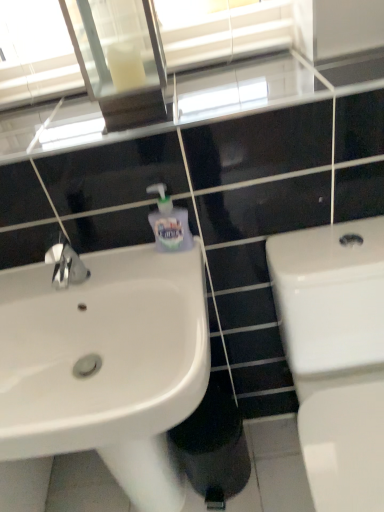
Question: From a real-world perspective, is clear glass mirror at upper center under translucent plastic soap dispenser at upper center?

Choices:
 (A) no
 (B) yes

Answer: (A)

Question: Is clear glass mirror at upper center smaller than translucent plastic soap dispenser at upper center?

Choices:
 (A) no
 (B) yes

Answer: (A)

Question: Is clear glass mirror at upper center oriented towards translucent plastic soap dispenser at upper center?

Choices:
 (A) yes
 (B) no

Answer: (B)

Question: From the image's perspective, is clear glass mirror at upper center beneath translucent plastic soap dispenser at upper center?

Choices:
 (A) yes
 (B) no

Answer: (B)

Question: Is clear glass mirror at upper center shorter than translucent plastic soap dispenser at upper center?

Choices:
 (A) yes
 (B) no

Answer: (B)

Question: From the image's perspective, does clear glass mirror at upper center appear higher than translucent plastic soap dispenser at upper center?

Choices:
 (A) yes
 (B) no

Answer: (A)

Question: From the image's perspective, does white glossy sink at left appear lower than white glossy toilet at right?

Choices:
 (A) yes
 (B) no

Answer: (B)

Question: Considering the relative sizes of white glossy sink at left and white glossy toilet at right in the image provided, is white glossy sink at left wider than white glossy toilet at right?

Choices:
 (A) no
 (B) yes

Answer: (A)

Question: Is white glossy sink at left further to the viewer compared to white glossy toilet at right?

Choices:
 (A) no
 (B) yes

Answer: (B)

Question: Is white glossy sink at left positioned in front of white glossy toilet at right?

Choices:
 (A) no
 (B) yes

Answer: (A)

Question: Does white glossy sink at left have a larger size compared to white glossy toilet at right?

Choices:
 (A) yes
 (B) no

Answer: (B)

Question: Considering the relative sizes of white glossy sink at left and white glossy toilet at right in the image provided, is white glossy sink at left shorter than white glossy toilet at right?

Choices:
 (A) yes
 (B) no

Answer: (A)

Question: Is translucent plastic soap dispenser at upper center wider than white glossy toilet at right?

Choices:
 (A) yes
 (B) no

Answer: (B)